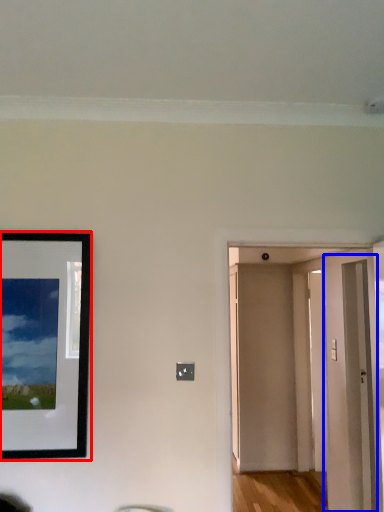
Question: Among these objects, which one is nearest to the camera, picture frame (highlighted by a red box) or glass door (highlighted by a blue box)?

Choices:
 (A) picture frame
 (B) glass door

Answer: (A)